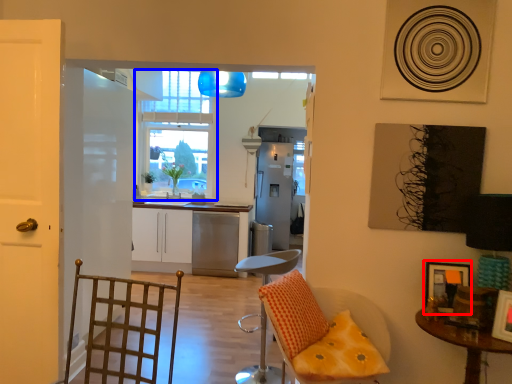
Question: Which of the following is the farthest to the observer, picture frame (highlighted by a red box) or window (highlighted by a blue box)?

Choices:
 (A) picture frame
 (B) window

Answer: (B)